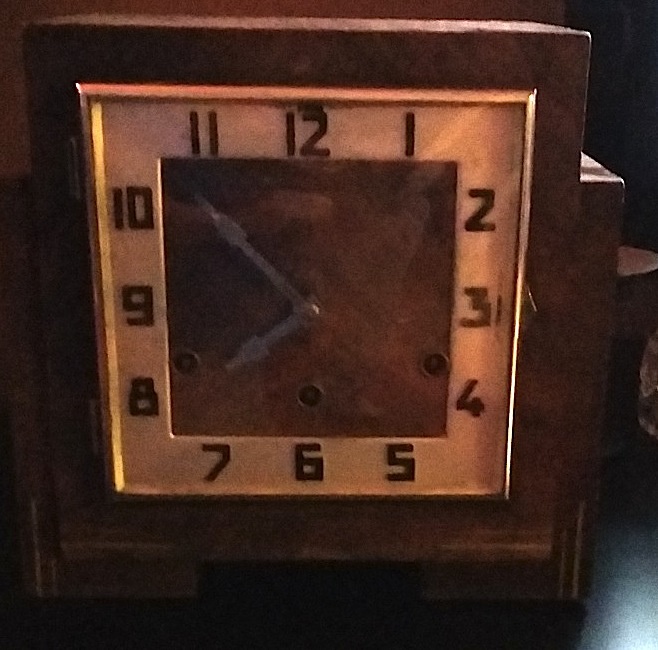
I want to click on holes in clock face, so coord(190,361), coord(308,390), coord(440,363).